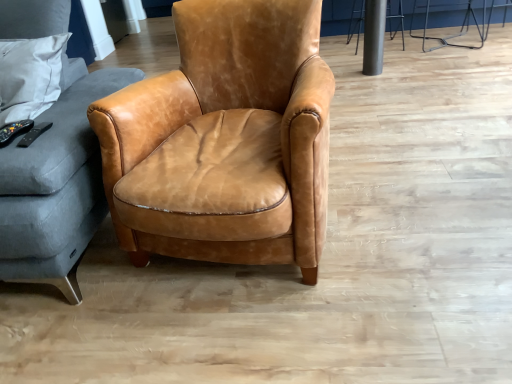
Locate an element on the screen. vacant area located to the right-hand side of cognac leather armchair at center is located at coordinates (412, 195).